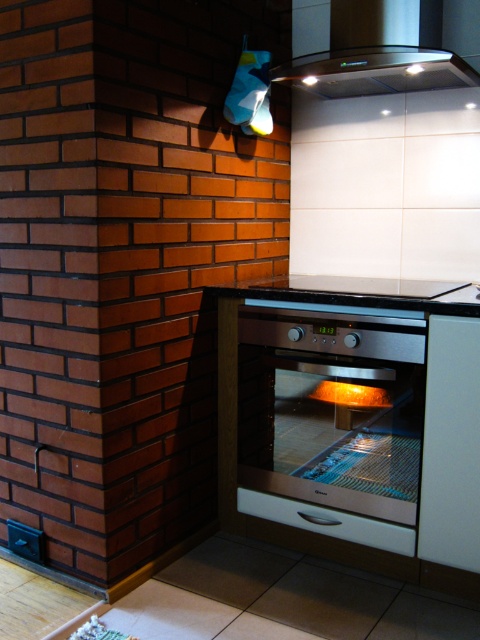
Between satin silver oven at center and white glossy drawer at lower center, which one is positioned higher?

satin silver oven at center is above.

What do you see at coordinates (332, 420) in the screenshot? This screenshot has width=480, height=640. I see `satin silver oven at center` at bounding box center [332, 420].

You are a GUI agent. You are given a task and a screenshot of the screen. Output one action in this format:
    pyautogui.click(x=<x>, y=<y>)
    Task: Click on the satin silver oven at center
    The height and width of the screenshot is (640, 480).
    Given the screenshot: What is the action you would take?
    pyautogui.click(x=332, y=420)

Can you confirm if satin black exhaust hood at upper center is thinner than white glossy drawer at lower center?

Incorrect, satin black exhaust hood at upper center's width is not less than white glossy drawer at lower center's.

Describe the element at coordinates (379, 51) in the screenshot. I see `satin black exhaust hood at upper center` at that location.

Is point (317, 60) farther from viewer compared to point (304, 506)?

No, (317, 60) is closer to viewer.

Find the location of a particular element. The image size is (480, 640). satin black exhaust hood at upper center is located at coordinates (379, 51).

What do you see at coordinates (379, 51) in the screenshot? The width and height of the screenshot is (480, 640). I see `satin black exhaust hood at upper center` at bounding box center [379, 51].

What are the coordinates of `satin black exhaust hood at upper center` in the screenshot? It's located at (379, 51).

Between point (304, 83) and point (433, 312), which one is positioned behind?

Positioned behind is point (304, 83).

Image resolution: width=480 pixels, height=640 pixels. I want to click on satin black exhaust hood at upper center, so click(379, 51).